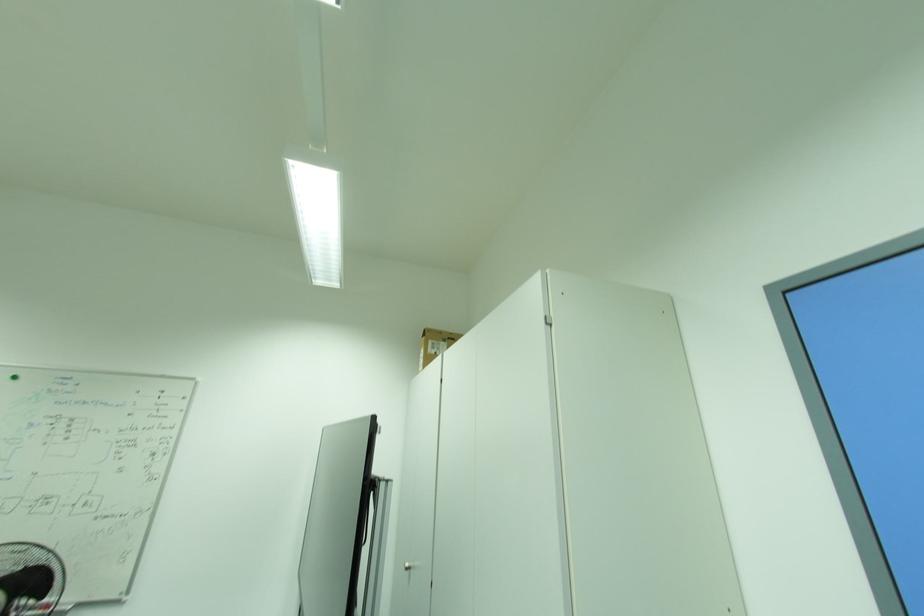
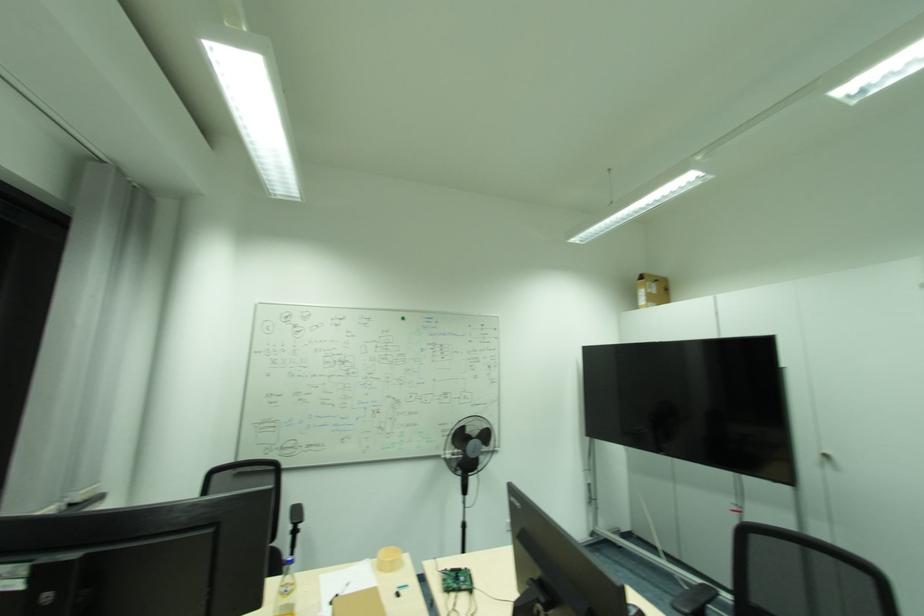
In the second image, find the point that corresponds to point (420, 373) in the first image.

(639, 307)